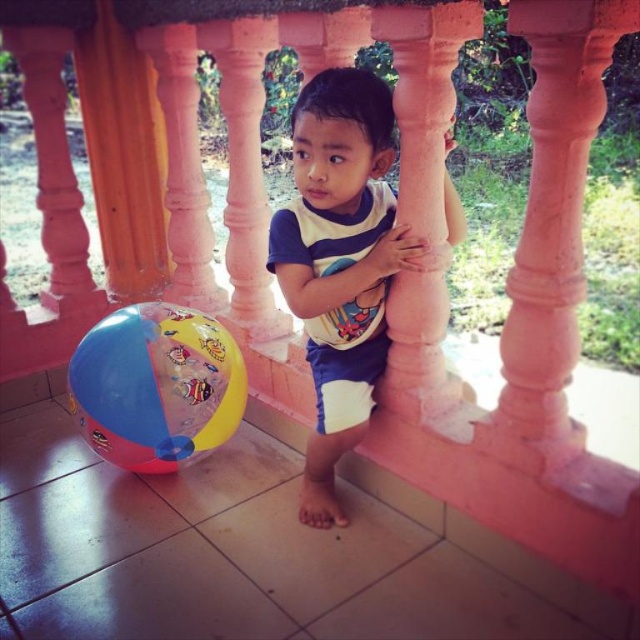
Question: Which point is farther to the camera?

Choices:
 (A) white cotton shirt at center
 (B) multicolored rubber ball at lower left

Answer: (B)

Question: Can you confirm if white cotton shirt at center is smaller than multicolored rubber ball at lower left?

Choices:
 (A) no
 (B) yes

Answer: (A)

Question: Can you confirm if white cotton shirt at center is positioned to the right of multicolored rubber ball at lower left?

Choices:
 (A) no
 (B) yes

Answer: (B)

Question: From the image, what is the correct spatial relationship of white cotton shirt at center in relation to multicolored rubber ball at lower left?

Choices:
 (A) below
 (B) above

Answer: (B)